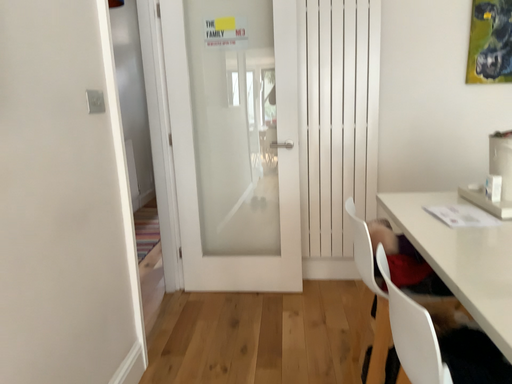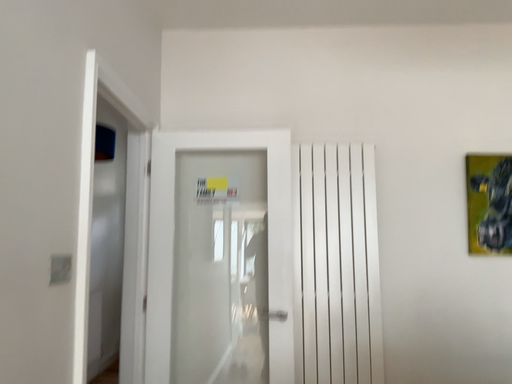
Question: How did the camera likely rotate when shooting the video?

Choices:
 (A) rotated downward
 (B) rotated upward

Answer: (B)